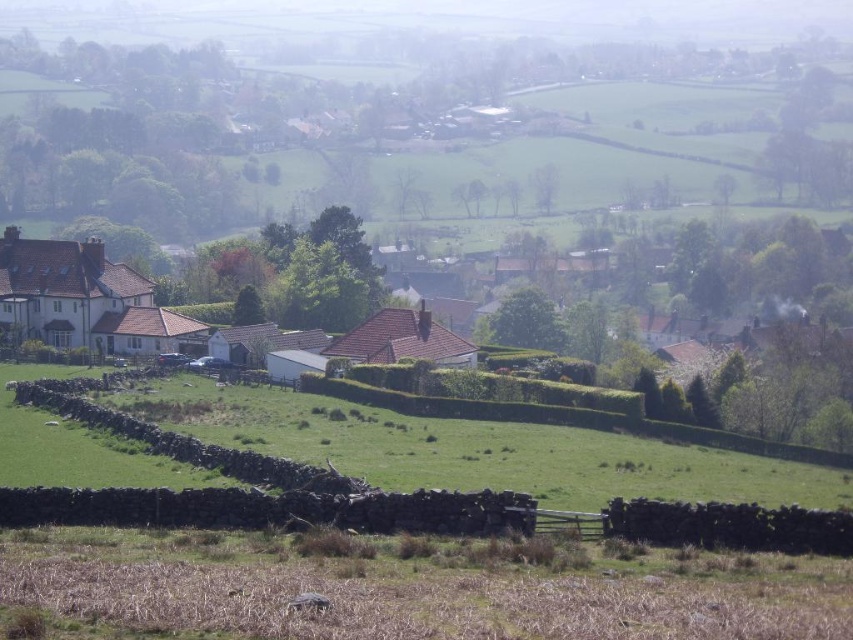
You are standing at the point marked as point (473, 449) in the image. What do you see around you?

You are standing in a green grassy field at lower center as indicated by point (473, 449).